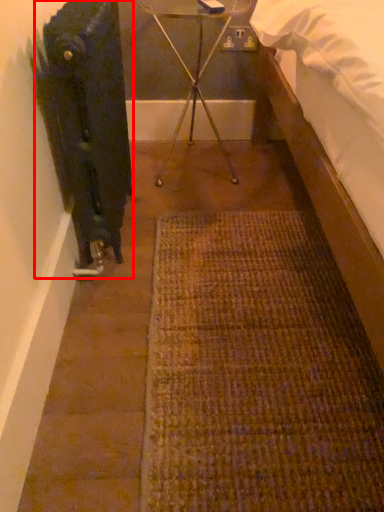
Question: From the image's perspective, what is the correct spatial positioning of radiator (annotated by the red box) in reference to tripod?

Choices:
 (A) below
 (B) above

Answer: (A)